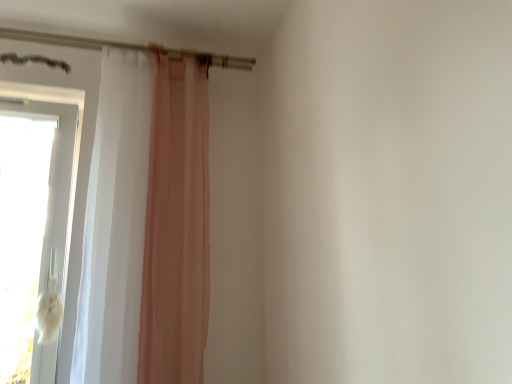
Question: Is white glossy door at left turned away from sheer white curtain at left?

Choices:
 (A) yes
 (B) no

Answer: (B)

Question: Considering the relative positions of white glossy door at left and sheer white curtain at left in the image provided, is white glossy door at left to the left of sheer white curtain at left from the viewer's perspective?

Choices:
 (A) yes
 (B) no

Answer: (A)

Question: Considering the relative sizes of white glossy door at left and sheer white curtain at left in the image provided, is white glossy door at left wider than sheer white curtain at left?

Choices:
 (A) no
 (B) yes

Answer: (B)

Question: Is white glossy door at left outside sheer white curtain at left?

Choices:
 (A) yes
 (B) no

Answer: (A)

Question: Is white glossy door at left in front of sheer white curtain at left?

Choices:
 (A) no
 (B) yes

Answer: (A)

Question: Can you confirm if white glossy door at left is taller than sheer white curtain at left?

Choices:
 (A) no
 (B) yes

Answer: (A)

Question: Would you say sheer white curtain at left contains white glossy door at left?

Choices:
 (A) no
 (B) yes

Answer: (A)

Question: Considering the relative sizes of sheer white curtain at left and white glossy door at left in the image provided, is sheer white curtain at left wider than white glossy door at left?

Choices:
 (A) no
 (B) yes

Answer: (A)

Question: Does sheer white curtain at left have a larger size compared to white glossy door at left?

Choices:
 (A) yes
 (B) no

Answer: (A)

Question: From the image's perspective, is sheer white curtain at left over white glossy door at left?

Choices:
 (A) yes
 (B) no

Answer: (A)

Question: Can you confirm if sheer white curtain at left is positioned to the left of white glossy door at left?

Choices:
 (A) yes
 (B) no

Answer: (B)

Question: From a real-world perspective, is sheer white curtain at left physically below white glossy door at left?

Choices:
 (A) yes
 (B) no

Answer: (B)

Question: From the image's perspective, is sheer white curtain at left above or below white glossy door at left?

Choices:
 (A) below
 (B) above

Answer: (B)